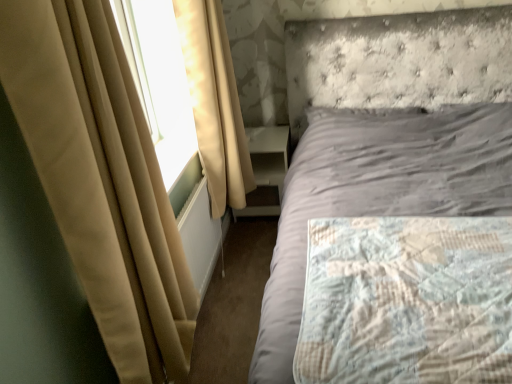
In order to face quilted fabric mattress at right, should I rotate leftwards or rightwards?

Rotate right and turn 21.494 degrees.

Find the location of a particular element. white plastic radiator at lower left is located at coordinates (199, 236).

Identify the location of quilted fabric mattress at right. This screenshot has height=384, width=512. (407, 301).

Based on their positions, is quilted fabric mattress at right located to the left or right of beige fabric curtain at left, which is the 1th curtain from back to front?

quilted fabric mattress at right is positioned on beige fabric curtain at left, which is the 1th curtain from back to front,'s right side.

Does quilted fabric mattress at right have a greater height compared to beige fabric curtain at left, which is the 1th curtain from back to front?

Incorrect, the height of quilted fabric mattress at right is not larger of that of beige fabric curtain at left, which is the 1th curtain from back to front.

Looking at this image, which of these two, quilted fabric mattress at right or beige fabric curtain at left, the second curtain from the front, is bigger?

beige fabric curtain at left, the second curtain from the front, is bigger.

The image size is (512, 384). In the image, there is a beige fabric curtain at left, the second curtain from the front. In order to click on mattress below it (from a real-world perspective) in this screenshot , I will do `click(407, 301)`.

In the image, is beige fabric curtain at left, placed as the first curtain when sorted from front to back, positioned in front of or behind white plastic radiator at lower left?

beige fabric curtain at left, placed as the first curtain when sorted from front to back, is in front of white plastic radiator at lower left.

Based on the photo, from a real-world perspective, is beige fabric curtain at left, placed as the first curtain when sorted from front to back, below white plastic radiator at lower left?

No, from a real-world perspective, beige fabric curtain at left, placed as the first curtain when sorted from front to back, is not below white plastic radiator at lower left.

Does beige fabric curtain at left, placed as the first curtain when sorted from front to back, have a greater width compared to white plastic radiator at lower left?

→ Yes.

Is white plastic radiator at lower left surrounded by beige fabric curtain at left, placed as the first curtain when sorted from front to back?

No, white plastic radiator at lower left is not surrounded by beige fabric curtain at left, placed as the first curtain when sorted from front to back.

Is beige fabric curtain at left, placed as the first curtain when sorted from front to back, shorter than quilted fabric mattress at right?

No.

Which object is wider, beige fabric curtain at left, placed as the first curtain when sorted from front to back, or quilted fabric mattress at right?

quilted fabric mattress at right is wider.

Is beige fabric curtain at left, placed as the first curtain when sorted from front to back, surrounding quilted fabric mattress at right?

Actually, quilted fabric mattress at right is outside beige fabric curtain at left, placed as the first curtain when sorted from front to back.

From a real-world perspective, who is located lower, beige fabric curtain at left, which is the 2th curtain from back to front, or quilted fabric mattress at right?

From a 3D spatial view, quilted fabric mattress at right is below.

Could you tell me if white glossy nightstand at center is turned towards beige fabric curtain at left, the second curtain from the front?

No, white glossy nightstand at center is not facing towards beige fabric curtain at left, the second curtain from the front.

Is white glossy nightstand at center far from beige fabric curtain at left, the second curtain from the front?

No, white glossy nightstand at center is in close proximity to beige fabric curtain at left, the second curtain from the front.

Between white glossy nightstand at center and beige fabric curtain at left, which is the 1th curtain from back to front, which one has smaller size?

white glossy nightstand at center.

Considering the relative positions of white plastic radiator at lower left and beige fabric curtain at left, placed as the first curtain when sorted from front to back, in the image provided, is white plastic radiator at lower left to the left of beige fabric curtain at left, placed as the first curtain when sorted from front to back, from the viewer's perspective?

In fact, white plastic radiator at lower left is to the right of beige fabric curtain at left, placed as the first curtain when sorted from front to back.

Is the depth of white plastic radiator at lower left greater than that of beige fabric curtain at left, placed as the first curtain when sorted from front to back?

Yes, white plastic radiator at lower left is behind beige fabric curtain at left, placed as the first curtain when sorted from front to back.

Is white plastic radiator at lower left oriented away from beige fabric curtain at left, placed as the first curtain when sorted from front to back?

white plastic radiator at lower left does not have its back to beige fabric curtain at left, placed as the first curtain when sorted from front to back.

Does white plastic radiator at lower left contain beige fabric curtain at left, placed as the first curtain when sorted from front to back?

No, beige fabric curtain at left, placed as the first curtain when sorted from front to back, is not a part of white plastic radiator at lower left.

Is white glossy nightstand at center shorter than white plastic radiator at lower left?

No, white glossy nightstand at center is not shorter than white plastic radiator at lower left.

Would you say white glossy nightstand at center is outside white plastic radiator at lower left?

white glossy nightstand at center is positioned outside white plastic radiator at lower left.

Is white glossy nightstand at center to the right of white plastic radiator at lower left from the viewer's perspective?

Correct, you'll find white glossy nightstand at center to the right of white plastic radiator at lower left.

Between white glossy nightstand at center and white plastic radiator at lower left, which one has smaller width?

white plastic radiator at lower left is thinner.

Which object is positioned more to the left, quilted fabric mattress at right or white plastic radiator at lower left?

white plastic radiator at lower left.

Considering the sizes of objects quilted fabric mattress at right and white plastic radiator at lower left in the image provided, who is thinner, quilted fabric mattress at right or white plastic radiator at lower left?

white plastic radiator at lower left is thinner.

At what (x,y) coordinates should I click in order to perform the action: click on radiator below the quilted fabric mattress at right (from a real-world perspective). Please return your answer as a coordinate pair (x, y). Looking at the image, I should click on (199, 236).

From the image's perspective, is quilted fabric mattress at right under white plastic radiator at lower left?

Yes, from the image's perspective, quilted fabric mattress at right is below white plastic radiator at lower left.

Identify the location of mattress below the beige fabric curtain at left, which is the 1th curtain from back to front (from the image's perspective). (407, 301).

From the image's perspective, starting from the white plastic radiator at lower left, which curtain is the 1st one above? Please provide its 2D coordinates.

[(101, 179)]

Which object lies further to the anchor point white glossy nightstand at center, quilted fabric mattress at right or beige fabric curtain at left, which is the 2th curtain from back to front?

beige fabric curtain at left, which is the 2th curtain from back to front, is positioned further to the anchor white glossy nightstand at center.

Looking at the image, which one is located closer to beige fabric curtain at left, the second curtain from the front, white plastic radiator at lower left or white glossy nightstand at center?

Based on the image, white plastic radiator at lower left appears to be nearer to beige fabric curtain at left, the second curtain from the front.

In the scene shown: Considering their positions, is quilted fabric mattress at right positioned further to white glossy nightstand at center than white plastic radiator at lower left?

The object further to white glossy nightstand at center is quilted fabric mattress at right.

Based on their spatial positions, is beige fabric curtain at left, placed as the first curtain when sorted from front to back, or white plastic radiator at lower left closer to white glossy nightstand at center?

Among the two, white plastic radiator at lower left is located nearer to white glossy nightstand at center.

Based on their spatial positions, is white glossy nightstand at center or beige fabric curtain at left, placed as the first curtain when sorted from front to back, further from white plastic radiator at lower left?

Among the two, beige fabric curtain at left, placed as the first curtain when sorted from front to back, is located further to white plastic radiator at lower left.

Which object lies further to the anchor point white plastic radiator at lower left, beige fabric curtain at left, placed as the first curtain when sorted from front to back, or quilted fabric mattress at right?

quilted fabric mattress at right is further to white plastic radiator at lower left.

Considering their positions, is beige fabric curtain at left, which is the 1th curtain from back to front, positioned closer to beige fabric curtain at left, which is the 2th curtain from back to front, than quilted fabric mattress at right?

The object closer to beige fabric curtain at left, which is the 2th curtain from back to front, is quilted fabric mattress at right.

From the image, which object appears to be farther from quilted fabric mattress at right, white plastic radiator at lower left or beige fabric curtain at left, the second curtain from the front?

Based on the image, beige fabric curtain at left, the second curtain from the front, appears to be further to quilted fabric mattress at right.

Image resolution: width=512 pixels, height=384 pixels. Identify the location of curtain between quilted fabric mattress at right and white glossy nightstand at center along the z-axis. (215, 103).

This screenshot has height=384, width=512. What are the coordinates of `curtain located between white plastic radiator at lower left and quilted fabric mattress at right in the left-right direction` in the screenshot? It's located at (215, 103).

The image size is (512, 384). I want to click on curtain between beige fabric curtain at left, placed as the first curtain when sorted from front to back, and white glossy nightstand at center from front to back, so click(x=215, y=103).

Locate an element on the screen. The width and height of the screenshot is (512, 384). mattress positioned between beige fabric curtain at left, placed as the first curtain when sorted from front to back, and white glossy nightstand at center from near to far is located at coordinates (407, 301).